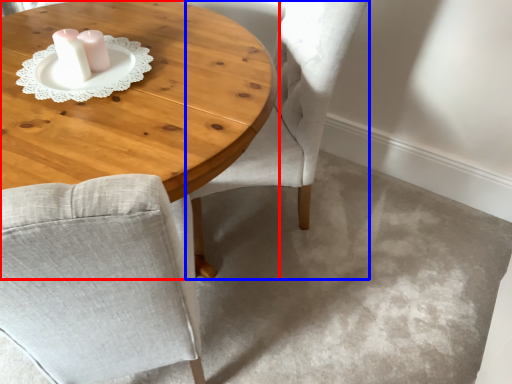
Question: Which object is further to the camera taking this photo, coffee table (highlighted by a red box) or chair (highlighted by a blue box)?

Choices:
 (A) coffee table
 (B) chair

Answer: (B)